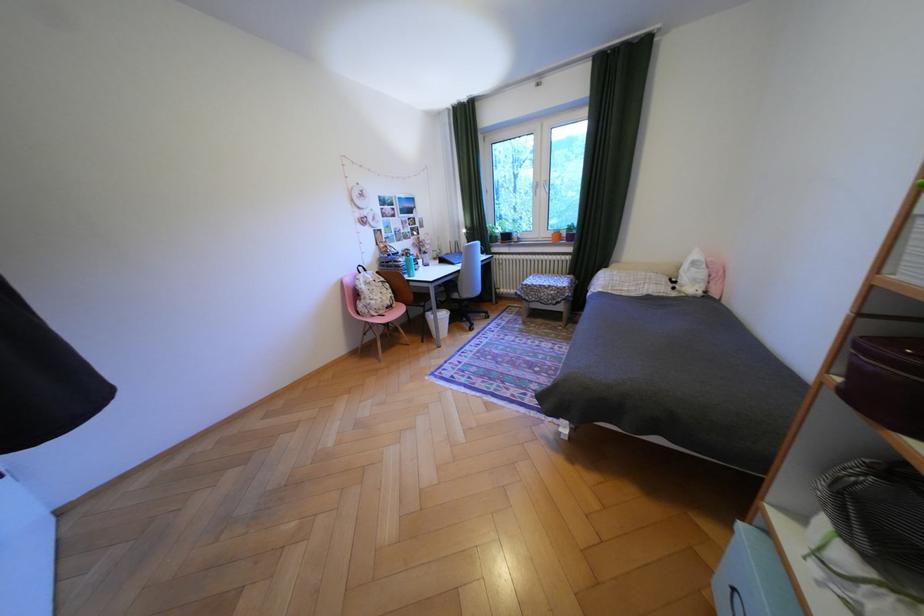
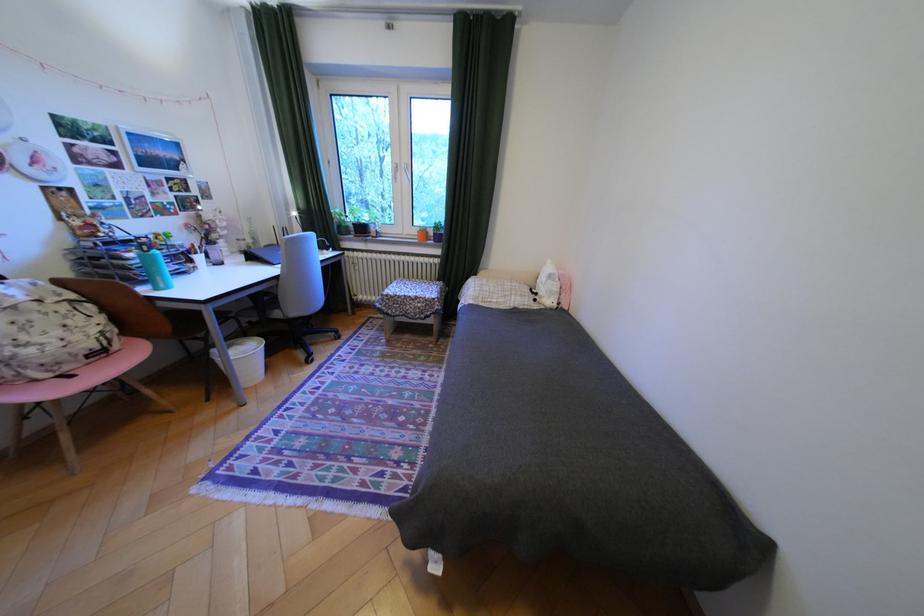
The point at (x=411, y=259) is marked in the first image. Where is the corresponding point in the second image?

(140, 254)